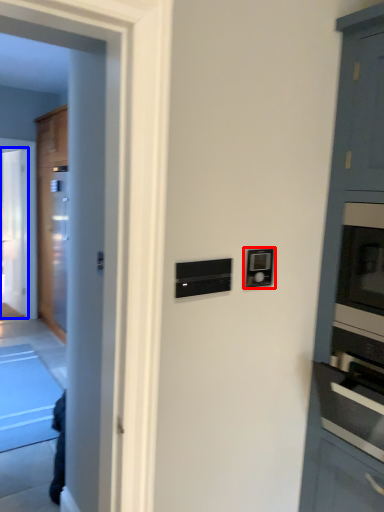
Question: Among these objects, which one is farthest to the camera, light switch (highlighted by a red box) or glass door (highlighted by a blue box)?

Choices:
 (A) light switch
 (B) glass door

Answer: (B)